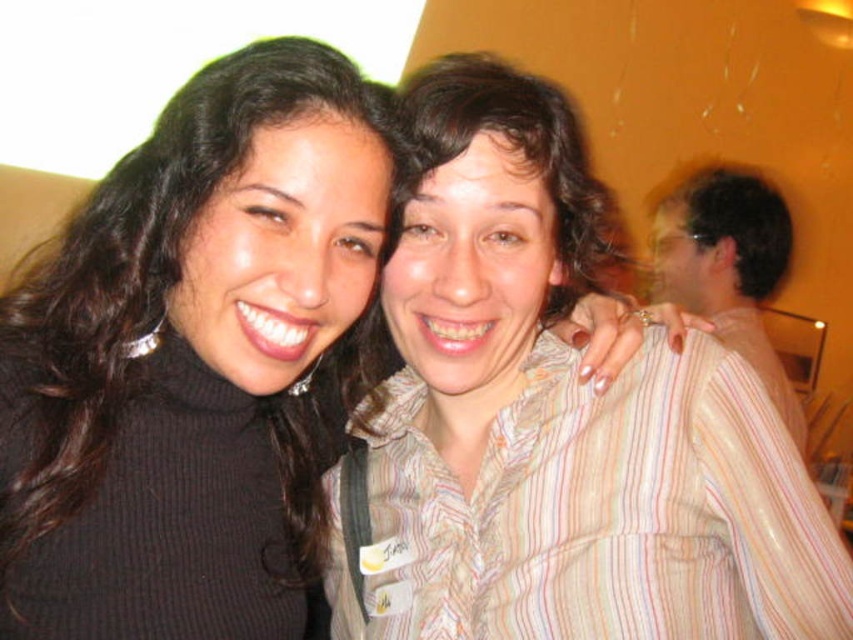
Question: Does black ribbed turtleneck sweater at left come in front of striped shirt at right?

Choices:
 (A) no
 (B) yes

Answer: (B)

Question: Which object is positioned closest to the striped shirt at right?

Choices:
 (A) black ribbed turtleneck sweater at left
 (B) striped cotton shirt at center

Answer: (B)

Question: Which object is positioned closest to the striped cotton shirt at center?

Choices:
 (A) black ribbed turtleneck sweater at left
 (B) striped shirt at right

Answer: (A)

Question: Can you confirm if black ribbed turtleneck sweater at left is positioned below striped shirt at right?

Choices:
 (A) yes
 (B) no

Answer: (A)

Question: Is black ribbed turtleneck sweater at left further to camera compared to striped shirt at right?

Choices:
 (A) no
 (B) yes

Answer: (A)

Question: Which object appears farthest from the camera in this image?

Choices:
 (A) black ribbed turtleneck sweater at left
 (B) striped cotton shirt at center
 (C) striped shirt at right

Answer: (C)